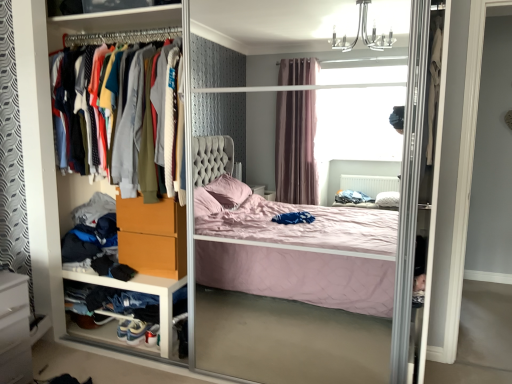
The image size is (512, 384). Find the location of `vacant space to the right of white leather shoe at lower left, which ranks as the 1th shoe in right-to-left order`. vacant space to the right of white leather shoe at lower left, which ranks as the 1th shoe in right-to-left order is located at coordinates (151, 347).